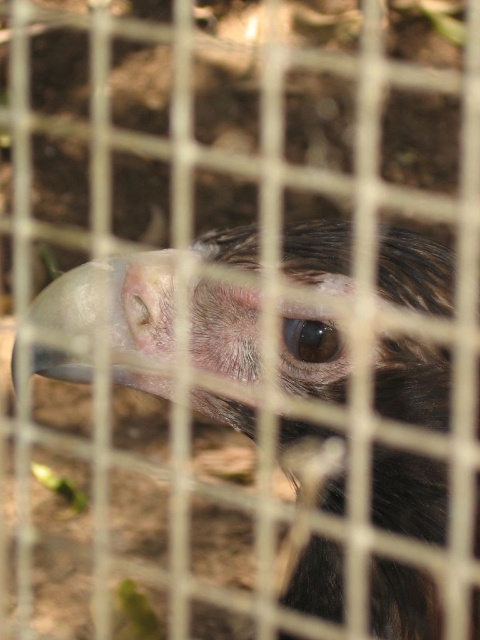
Which is above, smooth feathered eagle at center or brown glossy eye at center?

brown glossy eye at center

Is smooth feathered eagle at center further to camera compared to brown glossy eye at center?

No, smooth feathered eagle at center is closer to the viewer.

Describe the element at coordinates (339, 381) in the screenshot. I see `smooth feathered eagle at center` at that location.

You are a GUI agent. You are given a task and a screenshot of the screen. Output one action in this format:
    pyautogui.click(x=<x>, y=<y>)
    Task: Click on the smooth feathered eagle at center
    This screenshot has width=480, height=640.
    Given the screenshot: What is the action you would take?
    pyautogui.click(x=339, y=381)